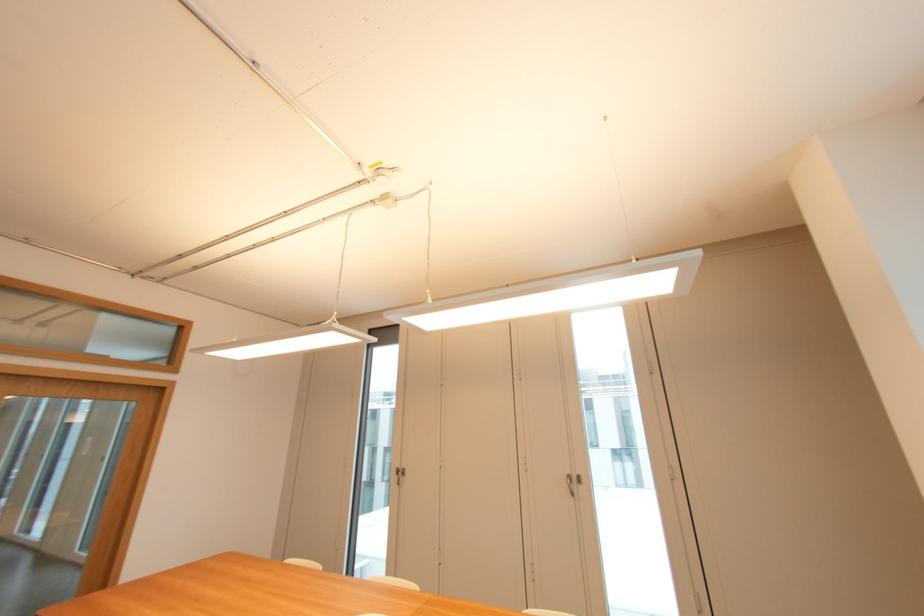
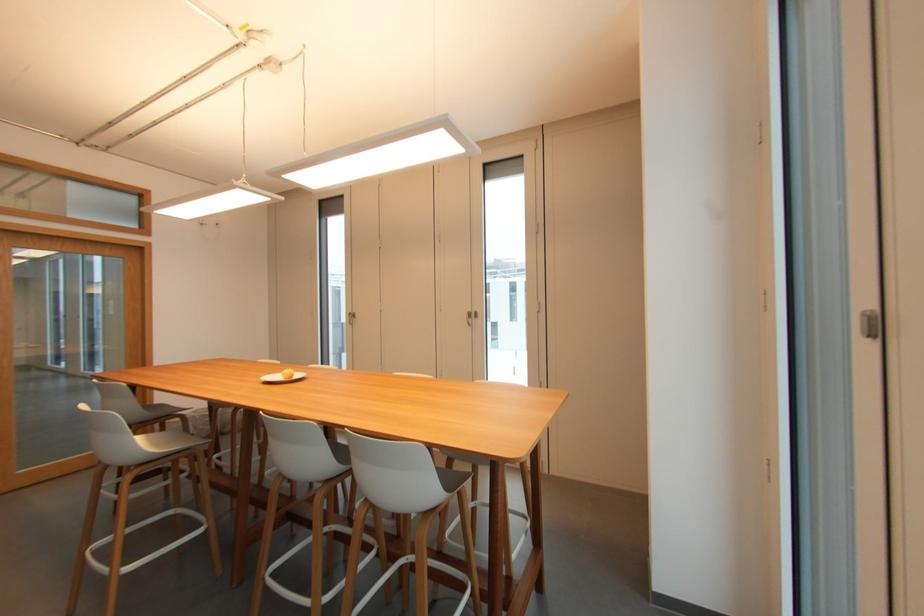
Locate, in the second image, the point that corresponds to pixel 403 467 in the first image.

(354, 312)